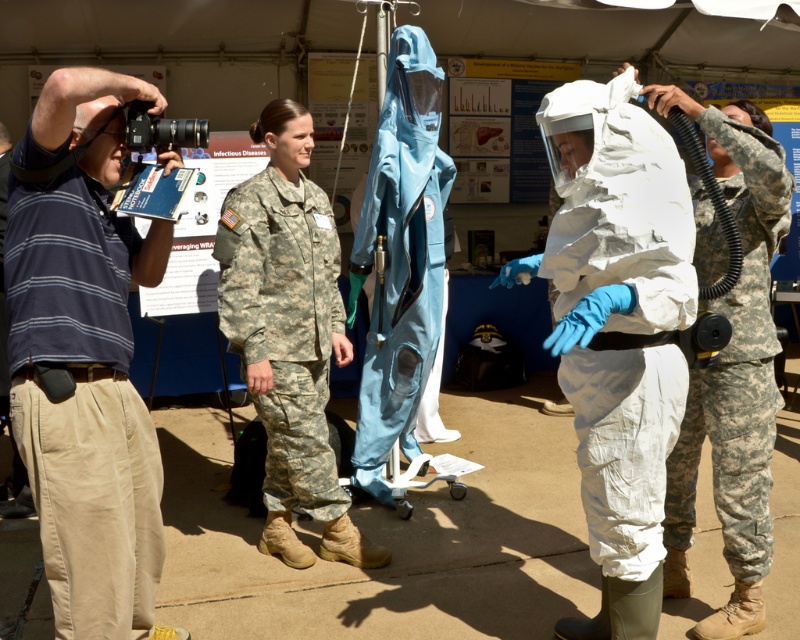
Question: Among these points, which one is nearest to the camera?

Choices:
 (A) (276, 337)
 (B) (114, 513)
 (C) (696, 426)

Answer: (B)

Question: Among these objects, which one is nearest to the camera?

Choices:
 (A) striped cotton polo shirt at left
 (B) white matte hazmat suit at center

Answer: (B)

Question: Does camouflage fabric uniform at center appear on the left side of striped cotton shirt at left?

Choices:
 (A) yes
 (B) no

Answer: (B)

Question: Can you confirm if striped cotton polo shirt at left is thinner than camouflage fabric uniform at right?

Choices:
 (A) yes
 (B) no

Answer: (A)

Question: Can you confirm if striped cotton polo shirt at left is smaller than white matte hazmat suit at center?

Choices:
 (A) yes
 (B) no

Answer: (A)

Question: Which object is closer to the camera taking this photo?

Choices:
 (A) camouflage fabric uniform at right
 (B) striped cotton shirt at left

Answer: (A)